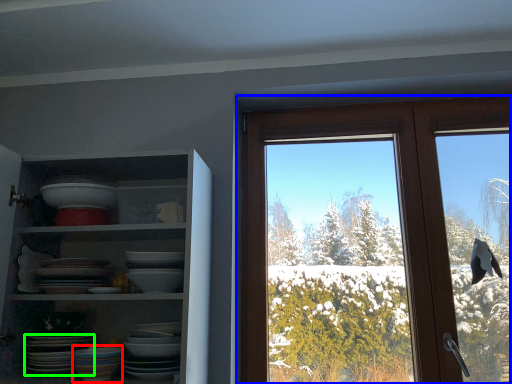
Question: Based on their relative distances, which object is farther from tableware (highlighted by a red box)? Choose from window (highlighted by a blue box) and platter (highlighted by a green box).

Choices:
 (A) window
 (B) platter

Answer: (A)